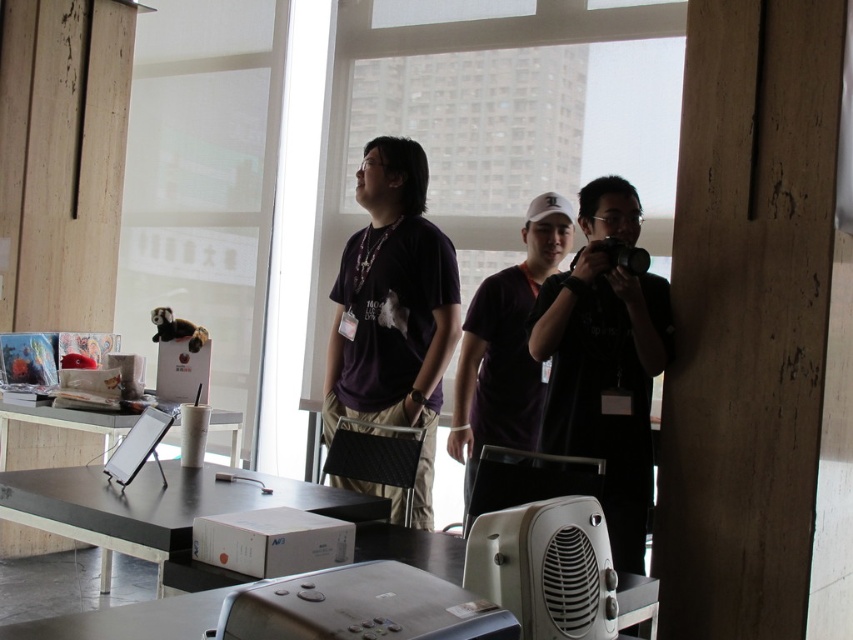
Question: Can you confirm if slate gray plastic projector at lower center is bigger than purple matte shirt at center?

Choices:
 (A) yes
 (B) no

Answer: (B)

Question: Is matte black shirt at center thinner than slate gray plastic projector at lower center?

Choices:
 (A) no
 (B) yes

Answer: (A)

Question: Which object is positioned farthest from the purple matte shirt at center?

Choices:
 (A) matte black shirt at center
 (B) slate gray plastic projector at lower center

Answer: (B)

Question: Which of the following is the farthest from the observer?

Choices:
 (A) matte black shirt at center
 (B) purple matte shirt at center

Answer: (B)

Question: Which point is farther from the camera taking this photo?

Choices:
 (A) (485, 378)
 (B) (424, 593)
 (C) (416, 476)

Answer: (A)

Question: Is matte black shirt at center smaller than slate gray plastic projector at lower center?

Choices:
 (A) yes
 (B) no

Answer: (B)